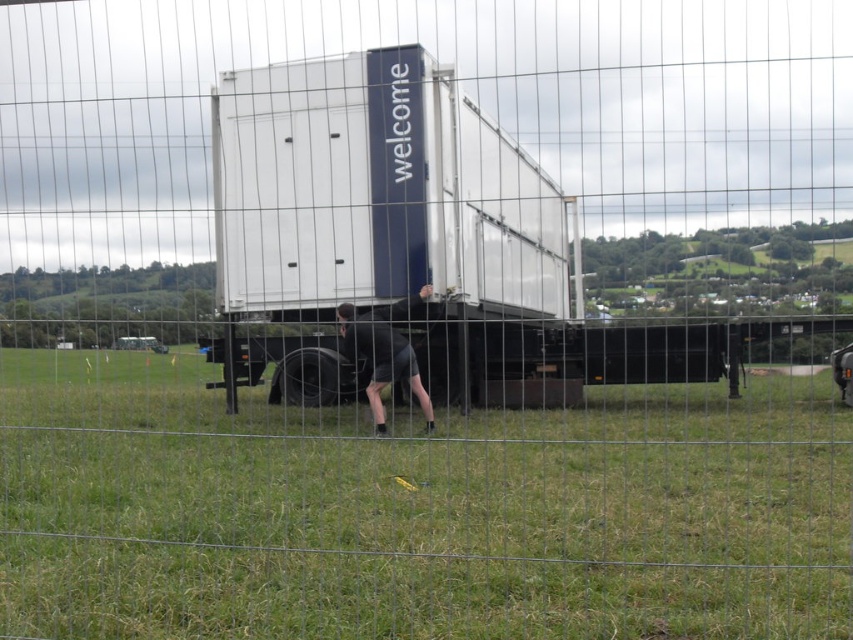
Does green grass at lower center appear under white matte truck at center?

Yes.

Does point (473, 456) come closer to viewer compared to point (561, 358)?

Yes, it is.

Identify the location of green grass at lower center. (416, 509).

Who is taller, white matte truck at center or black matte shorts at lower center?

white matte truck at center

Locate an element on the screen. The image size is (853, 640). white matte truck at center is located at coordinates (467, 250).

What are the coordinates of `green grass at lower center` in the screenshot? It's located at [x=416, y=509].

Is green grass at lower center taller than black matte shorts at lower center?

In fact, green grass at lower center may be shorter than black matte shorts at lower center.

Which is in front, point (486, 624) or point (413, 390)?

Point (486, 624) is in front.

The height and width of the screenshot is (640, 853). I want to click on green grass at lower center, so click(x=416, y=509).